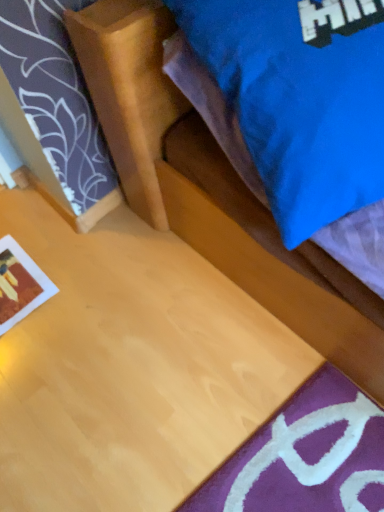
Where is `vacant area that is in front of matte paper print at lower left`? Image resolution: width=384 pixels, height=512 pixels. vacant area that is in front of matte paper print at lower left is located at coordinates (37, 354).